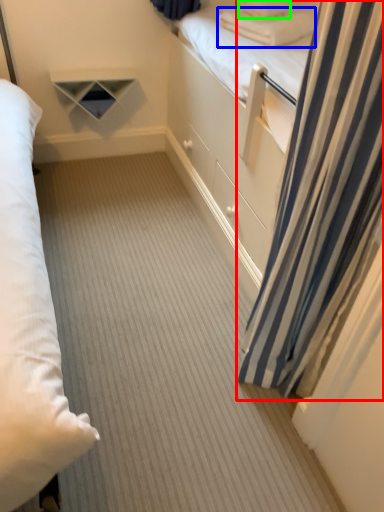
Question: Which is nearer to the curtain (highlighted by a red box)? pillow (highlighted by a blue box) or pillow (highlighted by a green box).

Choices:
 (A) pillow
 (B) pillow

Answer: (A)